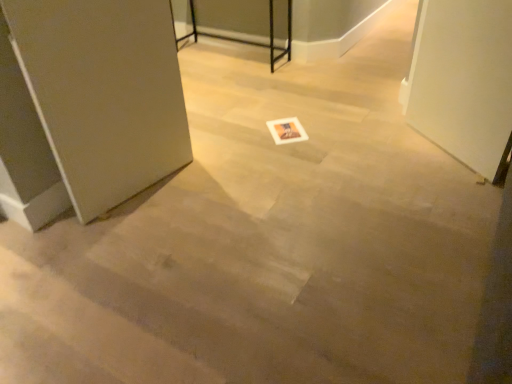
The image size is (512, 384). I want to click on vacant space situated above white paper postcard at center (from a real-world perspective), so click(x=284, y=127).